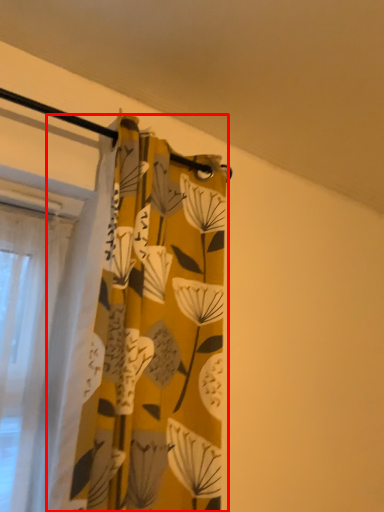
Question: Considering the relative positions of curtain (annotated by the red box) and backdrop in the image provided, where is curtain (annotated by the red box) located with respect to the staircase?

Choices:
 (A) left
 (B) right

Answer: (A)